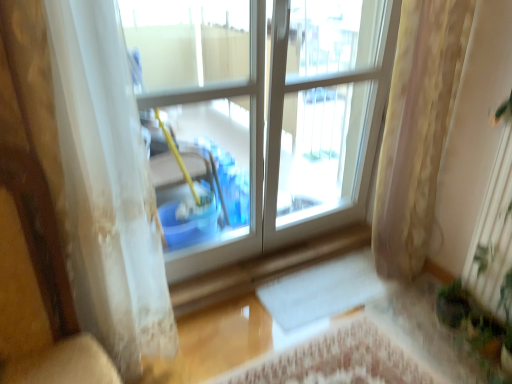
This screenshot has width=512, height=384. What do you see at coordinates (417, 130) in the screenshot? I see `yellow floral fabric curtain at right, arranged as the 1th curtain when viewed from the right` at bounding box center [417, 130].

Locate an element on the screen. white sheer curtain at left, which is the second curtain in right-to-left order is located at coordinates (108, 188).

The height and width of the screenshot is (384, 512). I want to click on yellow floral fabric curtain at right, arranged as the 1th curtain when viewed from the right, so [417, 130].

Does wooden armchair at left turn towards green leafy plant at lower right?

No, wooden armchair at left is not turned towards green leafy plant at lower right.

Is wooden armchair at left not close to green leafy plant at lower right?

Absolutely, wooden armchair at left is distant from green leafy plant at lower right.

This screenshot has width=512, height=384. Find the location of `plant that appears behind the wooden armchair at left`. plant that appears behind the wooden armchair at left is located at coordinates (477, 328).

The image size is (512, 384). What are the coordinates of `armchair that is under the white sheer curtain at left, which is the second curtain in right-to-left order (from a real-world perspective)` in the screenshot? It's located at (50, 281).

Between wooden armchair at left and white sheer curtain at left, which is the second curtain in right-to-left order, which one appears on the right side from the viewer's perspective?

Positioned to the right is wooden armchair at left.

Is wooden armchair at left spatially inside white sheer curtain at left, which is counted as the 1th curtain, starting from the left, or outside of it?

wooden armchair at left is not enclosed by white sheer curtain at left, which is counted as the 1th curtain, starting from the left.

Based on the photo, based on their sizes in the image, would you say wooden armchair at left is bigger or smaller than white sheer curtain at left, which is counted as the 1th curtain, starting from the left?

wooden armchair at left is smaller than white sheer curtain at left, which is counted as the 1th curtain, starting from the left.

Considering the positions of objects wooden armchair at left and yellow floral fabric curtain at right, arranged as the 1th curtain when viewed from the right, in the image provided, who is more to the left, wooden armchair at left or yellow floral fabric curtain at right, arranged as the 1th curtain when viewed from the right,?

wooden armchair at left is more to the left.

Based on the photo, considering the relative sizes of wooden armchair at left and yellow floral fabric curtain at right, arranged as the 1th curtain when viewed from the right, in the image provided, is wooden armchair at left thinner than yellow floral fabric curtain at right, arranged as the 1th curtain when viewed from the right,?

Incorrect, the width of wooden armchair at left is not less than that of yellow floral fabric curtain at right, arranged as the 1th curtain when viewed from the right.

Is wooden armchair at left spatially inside yellow floral fabric curtain at right, which is the 2th curtain from left to right, or outside of it?

wooden armchair at left is not inside yellow floral fabric curtain at right, which is the 2th curtain from left to right, it's outside.

Is wooden armchair at left facing away from yellow floral fabric curtain at right, which is the 2th curtain from left to right?

That's not correct — wooden armchair at left is not looking away from yellow floral fabric curtain at right, which is the 2th curtain from left to right.

From the image's perspective, which is below, green leafy plant at lower right or wooden armchair at left?

green leafy plant at lower right.

Which is in front, green leafy plant at lower right or wooden armchair at left?

wooden armchair at left is closer to the camera.

Can you see green leafy plant at lower right touching wooden armchair at left?

No.

From a real-world perspective, is green leafy plant at lower right located beneath wooden armchair at left?

Yes, from a real-world perspective, green leafy plant at lower right is below wooden armchair at left.

From the picture: Would you say green leafy plant at lower right is outside white sheer curtain at left, which is counted as the 1th curtain, starting from the left?

Indeed, green leafy plant at lower right is completely outside white sheer curtain at left, which is counted as the 1th curtain, starting from the left.

Where is `plant behind the white sheer curtain at left, which is counted as the 1th curtain, starting from the left`? plant behind the white sheer curtain at left, which is counted as the 1th curtain, starting from the left is located at coordinates (477, 328).

Is green leafy plant at lower right in front of or behind white sheer curtain at left, which is the second curtain in right-to-left order, in the image?

Clearly, green leafy plant at lower right is behind white sheer curtain at left, which is the second curtain in right-to-left order.

From a real-world perspective, who is located higher, green leafy plant at lower right or white sheer curtain at left, which is counted as the 1th curtain, starting from the left?

In real-world perspective, white sheer curtain at left, which is counted as the 1th curtain, starting from the left, is above.

Does green leafy plant at lower right appear on the right side of transparent plastic bucket at center?

Indeed, green leafy plant at lower right is positioned on the right side of transparent plastic bucket at center.

Which is in front, green leafy plant at lower right or transparent plastic bucket at center?

Positioned in front is transparent plastic bucket at center.

Considering the relative sizes of green leafy plant at lower right and transparent plastic bucket at center in the image provided, is green leafy plant at lower right shorter than transparent plastic bucket at center?

Yes, green leafy plant at lower right is shorter than transparent plastic bucket at center.

This screenshot has width=512, height=384. I want to click on window located in front of the green leafy plant at lower right, so click(x=268, y=109).

From the image's perspective, which is above, yellow floral fabric curtain at right, arranged as the 1th curtain when viewed from the right, or wooden armchair at left?

yellow floral fabric curtain at right, arranged as the 1th curtain when viewed from the right, appears higher in the image.

Is yellow floral fabric curtain at right, which is the 2th curtain from left to right, completely or partially outside of wooden armchair at left?

yellow floral fabric curtain at right, which is the 2th curtain from left to right, lies outside wooden armchair at left's area.

Is yellow floral fabric curtain at right, which is the 2th curtain from left to right, in front of wooden armchair at left?

No, it is behind wooden armchair at left.

The height and width of the screenshot is (384, 512). What are the coordinates of `plant that is under the wooden armchair at left (from a real-world perspective)` in the screenshot? It's located at (477, 328).

Where is `armchair in front of the white sheer curtain at left, which is counted as the 1th curtain, starting from the left`? The image size is (512, 384). armchair in front of the white sheer curtain at left, which is counted as the 1th curtain, starting from the left is located at coordinates (50, 281).

Estimate the real-world distances between objects in this image. Which object is closer to green leafy plant at lower right, wooden armchair at left or yellow floral fabric curtain at right, arranged as the 1th curtain when viewed from the right?

yellow floral fabric curtain at right, arranged as the 1th curtain when viewed from the right, lies closer to green leafy plant at lower right than the other object.

When comparing their distances from wooden armchair at left, does white sheer curtain at left, which is the second curtain in right-to-left order, or transparent plastic bucket at center seem further?

transparent plastic bucket at center is further to wooden armchair at left.

Estimate the real-world distances between objects in this image. Which object is closer to wooden armchair at left, green leafy plant at lower right or white sheer curtain at left, which is the second curtain in right-to-left order?

Based on the image, white sheer curtain at left, which is the second curtain in right-to-left order, appears to be nearer to wooden armchair at left.

Consider the image. Looking at the image, which one is located closer to yellow floral fabric curtain at right, which is the 2th curtain from left to right, transparent plastic bucket at center or green leafy plant at lower right?

The object closer to yellow floral fabric curtain at right, which is the 2th curtain from left to right, is transparent plastic bucket at center.

When comparing their distances from wooden armchair at left, does white sheer curtain at left, which is the second curtain in right-to-left order, or green leafy plant at lower right seem closer?

white sheer curtain at left, which is the second curtain in right-to-left order, is closer to wooden armchair at left.

Which object lies nearer to the anchor point yellow floral fabric curtain at right, arranged as the 1th curtain when viewed from the right, wooden armchair at left or transparent plastic bucket at center?

transparent plastic bucket at center lies closer to yellow floral fabric curtain at right, arranged as the 1th curtain when viewed from the right, than the other object.

When comparing their distances from white sheer curtain at left, which is the second curtain in right-to-left order, does yellow floral fabric curtain at right, arranged as the 1th curtain when viewed from the right, or transparent plastic bucket at center seem further?

yellow floral fabric curtain at right, arranged as the 1th curtain when viewed from the right, lies further to white sheer curtain at left, which is the second curtain in right-to-left order, than the other object.

Looking at the image, which one is located closer to wooden armchair at left, green leafy plant at lower right or transparent plastic bucket at center?

transparent plastic bucket at center is closer to wooden armchair at left.

The width and height of the screenshot is (512, 384). I want to click on curtain situated between white sheer curtain at left, which is the second curtain in right-to-left order, and green leafy plant at lower right from left to right, so click(417, 130).

Identify the location of armchair between white sheer curtain at left, which is counted as the 1th curtain, starting from the left, and green leafy plant at lower right from left to right. (50, 281).

Where is `curtain between wooden armchair at left and green leafy plant at lower right`? The height and width of the screenshot is (384, 512). curtain between wooden armchair at left and green leafy plant at lower right is located at coordinates (417, 130).

The image size is (512, 384). Find the location of `window situated between wooden armchair at left and yellow floral fabric curtain at right, arranged as the 1th curtain when viewed from the right, from left to right`. window situated between wooden armchair at left and yellow floral fabric curtain at right, arranged as the 1th curtain when viewed from the right, from left to right is located at coordinates (268, 109).